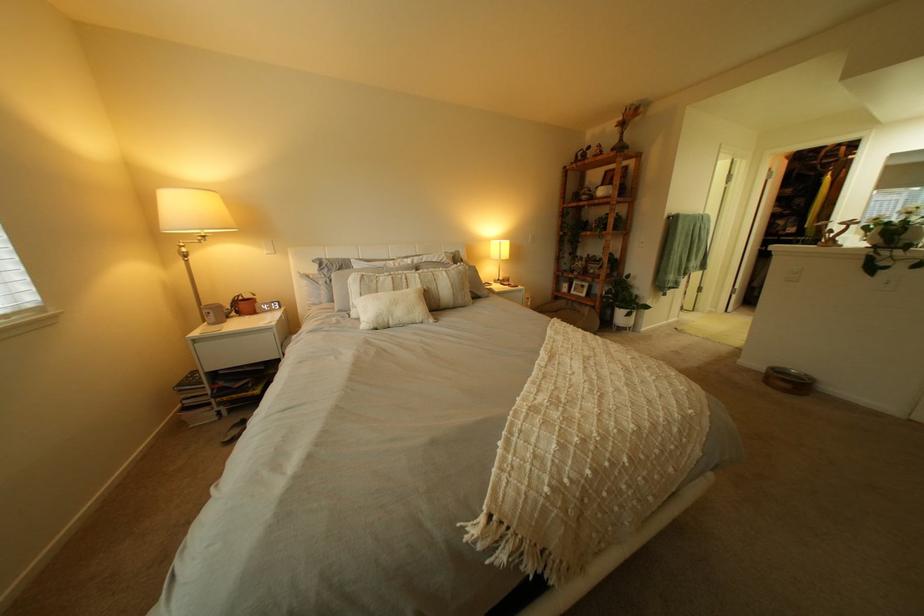
The width and height of the screenshot is (924, 616). What do you see at coordinates (213, 313) in the screenshot?
I see `the gray mug handle` at bounding box center [213, 313].